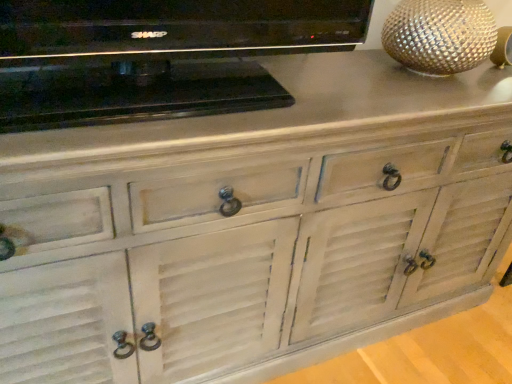
Find the location of a particular element. vacant region in front of gold textured sphere at upper right is located at coordinates (426, 102).